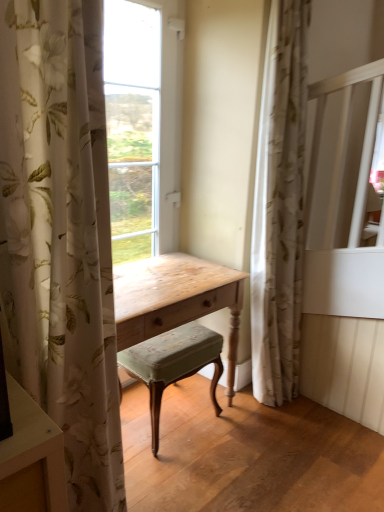
What do you see at coordinates (279, 207) in the screenshot? This screenshot has height=512, width=384. I see `floral sheer curtain at right, the second curtain viewed from the front` at bounding box center [279, 207].

At what (x,y) coordinates should I click in order to perform the action: click on floral sheer curtain at right, the second curtain viewed from the front. Please return your answer as a coordinate pair (x, y). The image size is (384, 512). Looking at the image, I should click on (279, 207).

The image size is (384, 512). I want to click on floral sheer curtain at right, which ranks as the second curtain in left-to-right order, so click(x=279, y=207).

From the image's perspective, is floral sheer curtain at right, which ranks as the second curtain in left-to-right order, on top of velvet green cushioned stool at center?

Yes, from the image's perspective, floral sheer curtain at right, which ranks as the second curtain in left-to-right order, is over velvet green cushioned stool at center.

Can we say floral sheer curtain at right, the second curtain viewed from the front, lies outside velvet green cushioned stool at center?

floral sheer curtain at right, the second curtain viewed from the front, is positioned outside velvet green cushioned stool at center.

Does point (289, 381) come behind point (127, 372)?

Yes, it is.

Looking at this image, from the image's perspective, is white floral fabric curtain at left, which appears as the 2th curtain when viewed from the back, above or below velvet green cushioned stool at center?

white floral fabric curtain at left, which appears as the 2th curtain when viewed from the back, is situated higher than velvet green cushioned stool at center in the image.

Considering the relative sizes of white floral fabric curtain at left, arranged as the 1th curtain when viewed from the front, and velvet green cushioned stool at center in the image provided, is white floral fabric curtain at left, arranged as the 1th curtain when viewed from the front, shorter than velvet green cushioned stool at center?

In fact, white floral fabric curtain at left, arranged as the 1th curtain when viewed from the front, may be taller than velvet green cushioned stool at center.

From a real-world perspective, who is located higher, white floral fabric curtain at left, the second curtain when ordered from right to left, or velvet green cushioned stool at center?

white floral fabric curtain at left, the second curtain when ordered from right to left, is physically above.

Considering the positions of objects white floral fabric curtain at left, the second curtain when ordered from right to left, and velvet green cushioned stool at center in the image provided, who is behind, white floral fabric curtain at left, the second curtain when ordered from right to left, or velvet green cushioned stool at center?

velvet green cushioned stool at center.

Does point (161, 366) come farther from viewer compared to point (32, 382)?

Yes.

Considering the positions of objects velvet green cushioned stool at center and white floral fabric curtain at left, arranged as the 1th curtain when viewed from the front, in the image provided, who is in front, velvet green cushioned stool at center or white floral fabric curtain at left, arranged as the 1th curtain when viewed from the front,?

white floral fabric curtain at left, arranged as the 1th curtain when viewed from the front, is closer to the camera.

Locate an element on the screen. This screenshot has height=512, width=384. stool located behind the white floral fabric curtain at left, arranged as the 1th curtain when viewed from the front is located at coordinates coord(173,364).

Is velvet green cushioned stool at center far from white floral fabric curtain at left, arranged as the 1th curtain when viewed from the front?

velvet green cushioned stool at center is near white floral fabric curtain at left, arranged as the 1th curtain when viewed from the front, not far away.

From their relative heights in the image, would you say floral sheer curtain at right, which ranks as the second curtain in left-to-right order, is taller or shorter than white floral fabric curtain at left, arranged as the 1th curtain when viewed from the front?

Result: Clearly, floral sheer curtain at right, which ranks as the second curtain in left-to-right order, is taller compared to white floral fabric curtain at left, arranged as the 1th curtain when viewed from the front.

Can we say floral sheer curtain at right, acting as the first curtain starting from the right, lies outside white floral fabric curtain at left, which appears as the 2th curtain when viewed from the back?

Yes.

This screenshot has width=384, height=512. What are the coordinates of `curtain on the right of white floral fabric curtain at left, the second curtain when ordered from right to left` in the screenshot? It's located at (279, 207).

Which object is positioned more to the right, floral sheer curtain at right, the first curtain from the back, or white floral fabric curtain at left, the second curtain when ordered from right to left?

floral sheer curtain at right, the first curtain from the back, is more to the right.

From their relative heights in the image, would you say velvet green cushioned stool at center is taller or shorter than floral sheer curtain at right, which ranks as the second curtain in left-to-right order?

Clearly, velvet green cushioned stool at center is shorter compared to floral sheer curtain at right, which ranks as the second curtain in left-to-right order.

Is point (143, 358) farther from camera compared to point (298, 67)?

No, (143, 358) is closer to viewer.

Visually, is velvet green cushioned stool at center positioned to the left or to the right of floral sheer curtain at right, which ranks as the second curtain in left-to-right order?

From the image, it's evident that velvet green cushioned stool at center is to the left of floral sheer curtain at right, which ranks as the second curtain in left-to-right order.

Are velvet green cushioned stool at center and floral sheer curtain at right, which ranks as the second curtain in left-to-right order, making contact?

No.

Can floral sheer curtain at right, which ranks as the second curtain in left-to-right order, be found inside white floral fabric curtain at left, which appears as the 2th curtain when viewed from the back?

No, floral sheer curtain at right, which ranks as the second curtain in left-to-right order, is not a part of white floral fabric curtain at left, which appears as the 2th curtain when viewed from the back.

Can you confirm if white floral fabric curtain at left, which appears as the 2th curtain when viewed from the back, is bigger than floral sheer curtain at right, acting as the first curtain starting from the right?

Incorrect, white floral fabric curtain at left, which appears as the 2th curtain when viewed from the back, is not larger than floral sheer curtain at right, acting as the first curtain starting from the right.

Is point (115, 443) farther from camera compared to point (292, 102)?

No.

Would you say white floral fabric curtain at left, the second curtain when ordered from right to left, is to the left or to the right of floral sheer curtain at right, the first curtain from the back, in the picture?

Clearly, white floral fabric curtain at left, the second curtain when ordered from right to left, is on the left of floral sheer curtain at right, the first curtain from the back, in the image.

At what (x,y) coordinates should I click in order to perform the action: click on curtain that is the 1st one when counting forward from the velvet green cushioned stool at center. Please return your answer as a coordinate pair (x, y). Looking at the image, I should click on (279, 207).

There is a velvet green cushioned stool at center. At what (x,y) coordinates should I click in order to perform the action: click on the 1st curtain above it (from a real-world perspective). Please return your answer as a coordinate pair (x, y). Looking at the image, I should click on (60, 234).

From the image, which object appears to be farther from white floral fabric curtain at left, arranged as the 1th curtain when viewed from the front, velvet green cushioned stool at center or floral sheer curtain at right, which ranks as the second curtain in left-to-right order?

floral sheer curtain at right, which ranks as the second curtain in left-to-right order, lies further to white floral fabric curtain at left, arranged as the 1th curtain when viewed from the front, than the other object.

Estimate the real-world distances between objects in this image. Which object is closer to floral sheer curtain at right, which ranks as the second curtain in left-to-right order, velvet green cushioned stool at center or white floral fabric curtain at left, marked as the first curtain in a left-to-right arrangement?

velvet green cushioned stool at center lies closer to floral sheer curtain at right, which ranks as the second curtain in left-to-right order, than the other object.

Looking at the image, which one is located closer to velvet green cushioned stool at center, white floral fabric curtain at left, marked as the first curtain in a left-to-right arrangement, or floral sheer curtain at right, the first curtain from the back?

floral sheer curtain at right, the first curtain from the back.

Considering their positions, is white floral fabric curtain at left, the second curtain when ordered from right to left, positioned further to floral sheer curtain at right, acting as the first curtain starting from the right, than velvet green cushioned stool at center?

The object further to floral sheer curtain at right, acting as the first curtain starting from the right, is white floral fabric curtain at left, the second curtain when ordered from right to left.

Based on their spatial positions, is floral sheer curtain at right, acting as the first curtain starting from the right, or velvet green cushioned stool at center closer to white floral fabric curtain at left, arranged as the 1th curtain when viewed from the front?

velvet green cushioned stool at center is closer to white floral fabric curtain at left, arranged as the 1th curtain when viewed from the front.

Which object lies further to the anchor point velvet green cushioned stool at center, floral sheer curtain at right, the first curtain from the back, or white floral fabric curtain at left, marked as the first curtain in a left-to-right arrangement?

Based on the image, white floral fabric curtain at left, marked as the first curtain in a left-to-right arrangement, appears to be further to velvet green cushioned stool at center.

Identify the location of curtain between white floral fabric curtain at left, marked as the first curtain in a left-to-right arrangement, and velvet green cushioned stool at center, along the z-axis. pyautogui.click(x=279, y=207).